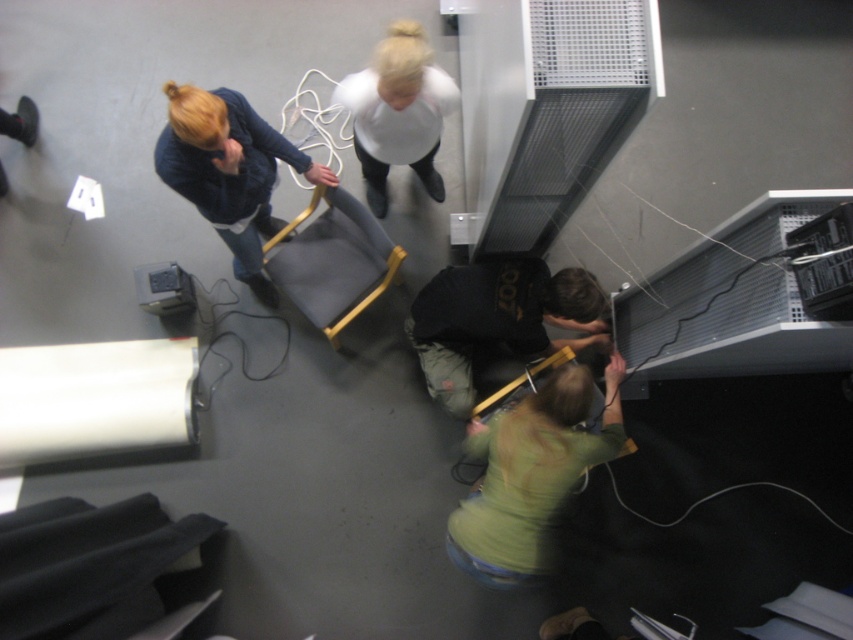
Is green matte shirt at lower center thinner than white matte shirt at center?

Incorrect, green matte shirt at lower center's width is not less than white matte shirt at center's.

Between green matte shirt at lower center and white matte shirt at center, which one appears on the left side from the viewer's perspective?

white matte shirt at center is more to the left.

This screenshot has width=853, height=640. What do you see at coordinates (531, 474) in the screenshot?
I see `green matte shirt at lower center` at bounding box center [531, 474].

At what (x,y) coordinates should I click in order to perform the action: click on green matte shirt at lower center. Please return your answer as a coordinate pair (x, y). This screenshot has width=853, height=640. Looking at the image, I should click on (531, 474).

Is point (262, 234) closer to viewer compared to point (187, 288)?

That is False.

Can you confirm if blonde hair at upper left is positioned below metallic gray projector at lower left?

Incorrect, blonde hair at upper left is not positioned below metallic gray projector at lower left.

The width and height of the screenshot is (853, 640). Describe the element at coordinates (229, 172) in the screenshot. I see `blonde hair at upper left` at that location.

Find the location of a particular element. The image size is (853, 640). blonde hair at upper left is located at coordinates point(229,172).

I want to click on dark green fabric at lower center, so click(x=497, y=321).

Which is in front, point (567, 310) or point (262, 150)?

Point (567, 310) is in front.

Is point (445, 276) farther from viewer compared to point (305, 176)?

Yes, it is.

In order to click on dark green fabric at lower center in this screenshot , I will do `click(497, 321)`.